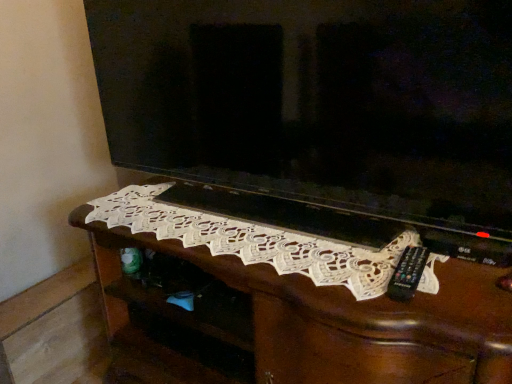
Find the location of a particular element. white lace doily at center is located at coordinates (289, 301).

Image resolution: width=512 pixels, height=384 pixels. Identify the location of matte black television at center. (321, 105).

Is white lace doily at center in contact with matte black television at center?

There is a gap between white lace doily at center and matte black television at center.

Relative to matte black television at center, is white lace doily at center in front or behind?

white lace doily at center is positioned farther from the viewer than matte black television at center.

Is matte black television at center at the back of white lace doily at center?

No, matte black television at center is not at the back of white lace doily at center.

Locate an element on the screen. This screenshot has height=384, width=512. embroidery lying below the matte black television at center (from the image's perspective) is located at coordinates (254, 241).

This screenshot has height=384, width=512. In order to click on furniture behind the matte black television at center in this screenshot , I will do `click(289, 301)`.

Is matte black television at center not within white lace doily at center?

Yes, matte black television at center is outside of white lace doily at center.

Who is bigger, matte black television at center or white lace doily at center?

With larger size is white lace doily at center.

Considering the positions of point (351, 148) and point (266, 362), is point (351, 148) closer or farther from the camera than point (266, 362)?

Point (351, 148) is closer to the camera than point (266, 362).

From the image's perspective, is white lace doily at center above or below white lace doily at center?

From the image's perspective, white lace doily at center appears below white lace doily at center.

Identify the location of embroidery above the white lace doily at center (from the image's perspective). (254, 241).

Which of these two, white lace doily at center or white lace doily at center, is wider?

white lace doily at center.

How distant is white lace doily at center from white lace doily at center?

The distance of white lace doily at center from white lace doily at center is 4.05 inches.

Between matte black television at center and white lace doily at center, which one has larger size?

matte black television at center.

Is matte black television at center situated inside white lace doily at center or outside?

matte black television at center exists outside the volume of white lace doily at center.

How many degrees apart are the facing directions of matte black television at center and white lace doily at center?

2.13 degrees.

At what (x,y) coordinates should I click in order to perform the action: click on embroidery behind the matte black television at center. Please return your answer as a coordinate pair (x, y). Looking at the image, I should click on (254, 241).

Considering the relative sizes of white lace doily at center and matte black television at center in the image provided, is white lace doily at center thinner than matte black television at center?

In fact, white lace doily at center might be wider than matte black television at center.

Would you consider white lace doily at center to be distant from matte black television at center?

That's not correct — white lace doily at center is a little close to matte black television at center.

Considering the relative positions of white lace doily at center and matte black television at center in the image provided, is white lace doily at center to the right of matte black television at center from the viewer's perspective?

Correct, you'll find white lace doily at center to the right of matte black television at center.

Can you confirm if white lace doily at center is bigger than matte black television at center?

Yes, white lace doily at center is bigger than matte black television at center.

Is white lace doily at center spatially inside white lace doily at center, or outside of it?

white lace doily at center is spatially positioned inside white lace doily at center.

Between white lace doily at center and white lace doily at center, which one has smaller size?

white lace doily at center.

Image resolution: width=512 pixels, height=384 pixels. I want to click on embroidery that appears above the white lace doily at center (from a real-world perspective), so click(x=254, y=241).

In terms of width, does white lace doily at center look wider or thinner when compared to white lace doily at center?

white lace doily at center is thinner than white lace doily at center.

Where is `television above the white lace doily at center (from a real-world perspective)`? television above the white lace doily at center (from a real-world perspective) is located at coordinates (321, 105).

Image resolution: width=512 pixels, height=384 pixels. I want to click on television above the white lace doily at center (from the image's perspective), so coord(321,105).

Looking at the image, which one is located closer to white lace doily at center, matte black television at center or white lace doily at center?

white lace doily at center lies closer to white lace doily at center than the other object.

When comparing their distances from white lace doily at center, does white lace doily at center or matte black television at center seem further?

Result: Among the two, matte black television at center is located further to white lace doily at center.

In the scene shown: When comparing their distances from white lace doily at center, does white lace doily at center or matte black television at center seem further?

matte black television at center is further to white lace doily at center.

Which object lies further to the anchor point white lace doily at center, matte black television at center or white lace doily at center?

matte black television at center is further to white lace doily at center.

When comparing their distances from matte black television at center, does white lace doily at center or white lace doily at center seem further?

white lace doily at center lies further to matte black television at center than the other object.

Which object lies further to the anchor point matte black television at center, white lace doily at center or white lace doily at center?

white lace doily at center lies further to matte black television at center than the other object.

The width and height of the screenshot is (512, 384). I want to click on embroidery that lies between matte black television at center and white lace doily at center from top to bottom, so click(x=254, y=241).